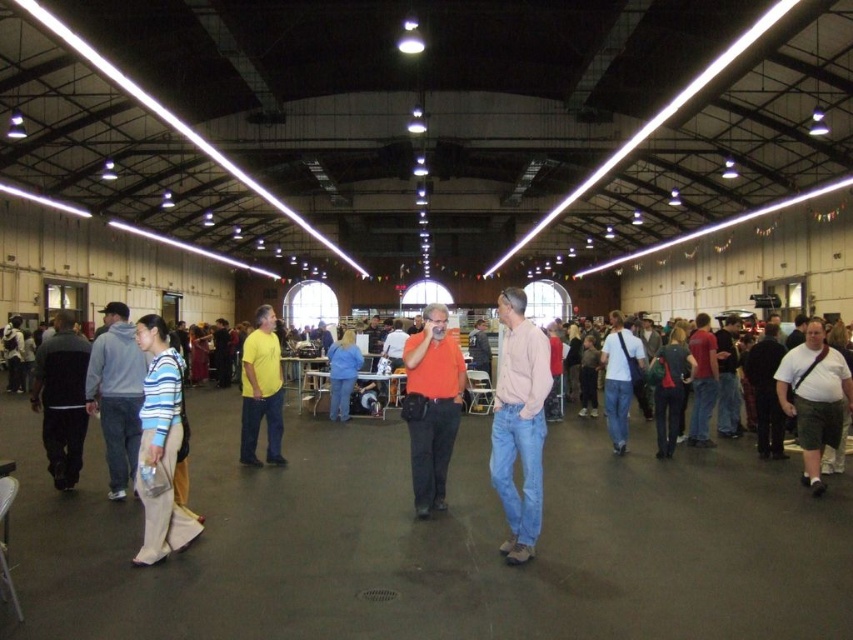
Question: Which of these objects is positioned closest to the dark gray pants at left?

Choices:
 (A) dark gray backpack at center right
 (B) orange shirt at center
 (C) matte yellow shirt at center
 (D) white cotton shirt at center

Answer: (C)

Question: Among these objects, which one is farthest from the camera?

Choices:
 (A) gray fleece jacket at left
 (B) orange matte shirt at center

Answer: (A)

Question: Can you confirm if gray fleece jacket at left is thinner than white cotton shirt at center?

Choices:
 (A) no
 (B) yes

Answer: (A)

Question: Estimate the real-world distances between objects in this image. Which object is closer to the blue denim jeans at center?

Choices:
 (A) dark gray pants at left
 (B) striped cotton sweater at left

Answer: (A)

Question: Can you confirm if orange shirt at center is positioned below blue denim jeans at center?

Choices:
 (A) yes
 (B) no

Answer: (A)

Question: Can you confirm if orange matte shirt at center is thinner than white cotton shirt at center?

Choices:
 (A) no
 (B) yes

Answer: (B)